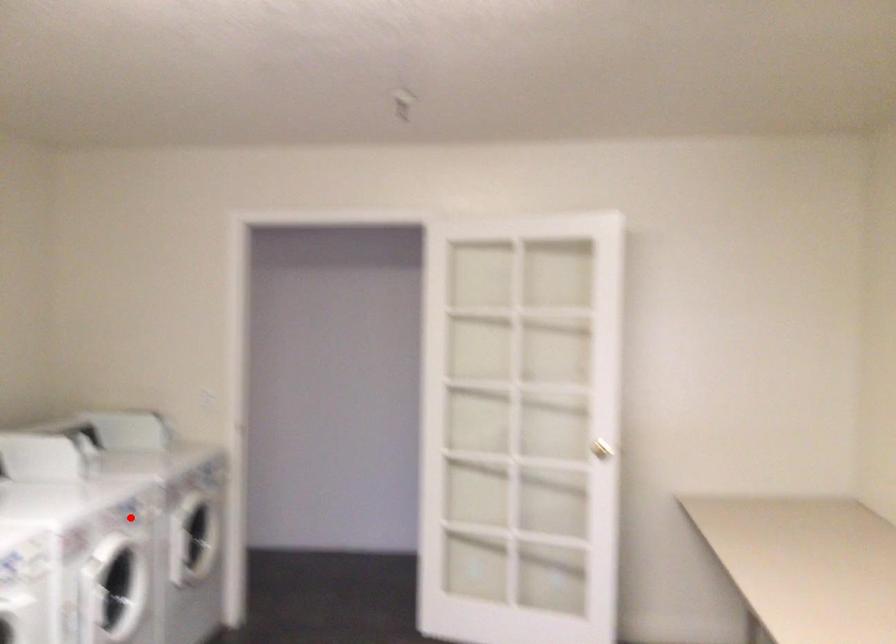
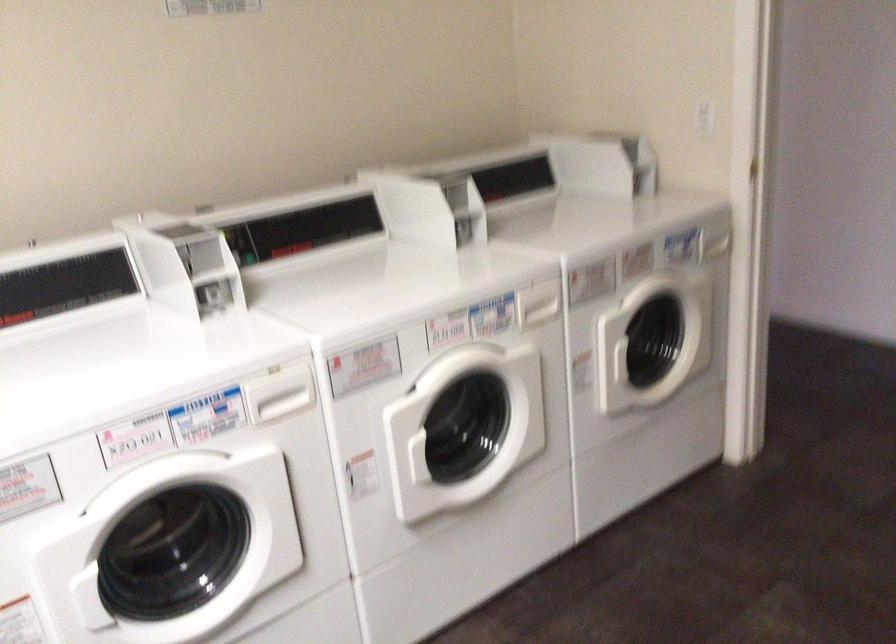
Where in the second image is the point corresponding to the highlighted location from the first image?

(474, 322)